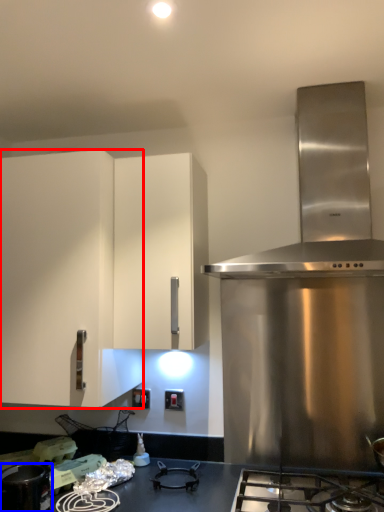
Question: Which point is closer to the camera, cabinetry (highlighted by a red box) or kitchen appliance (highlighted by a blue box)?

Choices:
 (A) cabinetry
 (B) kitchen appliance

Answer: (B)